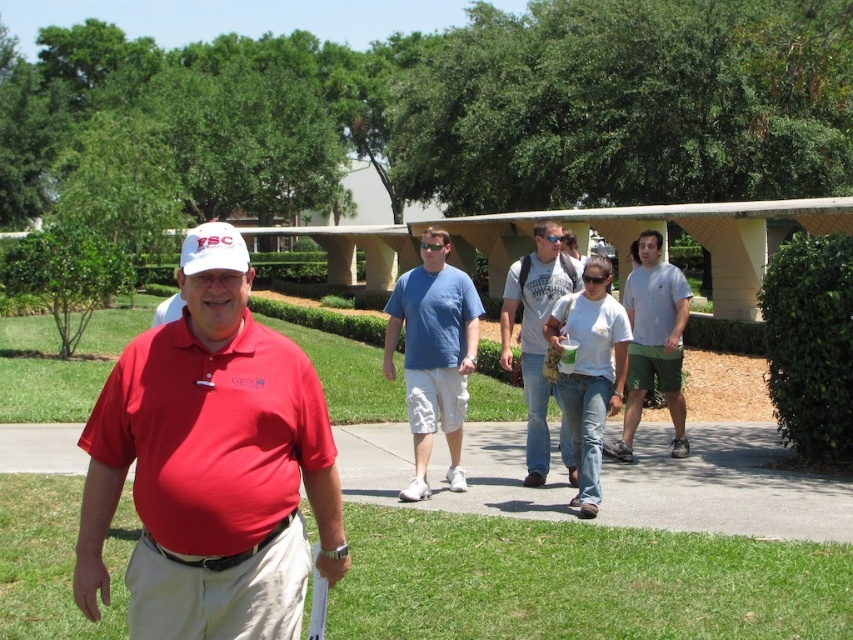
Question: Is gray concrete pavement at center below light gray cotton t-shirt at center?

Choices:
 (A) yes
 (B) no

Answer: (A)

Question: Is gray concrete pavement at center thinner than light gray cotton t-shirt at center?

Choices:
 (A) no
 (B) yes

Answer: (A)

Question: Considering the real-world distances, which object is closest to the light gray cotton t-shirt at center?

Choices:
 (A) gray cotton t-shirt at center
 (B) matte khaki pants at center

Answer: (A)

Question: Among these objects, which one is farthest from the camera?

Choices:
 (A) white matte baseball cap at center
 (B) white cotton shirt at center
 (C) gray cotton t-shirt at center
 (D) blue cotton polo shirt at center

Answer: (C)

Question: Observing the image, what is the correct spatial positioning of white cotton shirt at center in reference to white matte baseball cap at center?

Choices:
 (A) right
 (B) left

Answer: (A)

Question: Which object appears closest to the camera in this image?

Choices:
 (A) white matte baseball cap at center
 (B) white cotton shirt at center

Answer: (A)